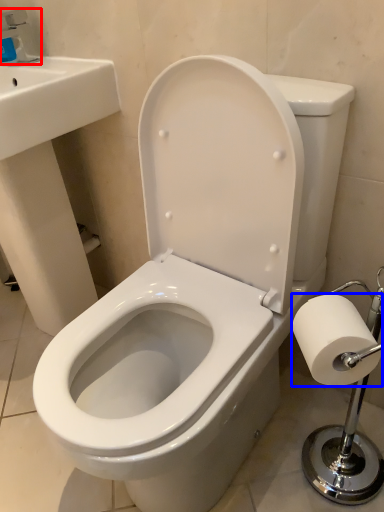
Question: Among these objects, which one is nearest to the camera, faucet (highlighted by a red box) or toilet paper (highlighted by a blue box)?

Choices:
 (A) faucet
 (B) toilet paper

Answer: (B)